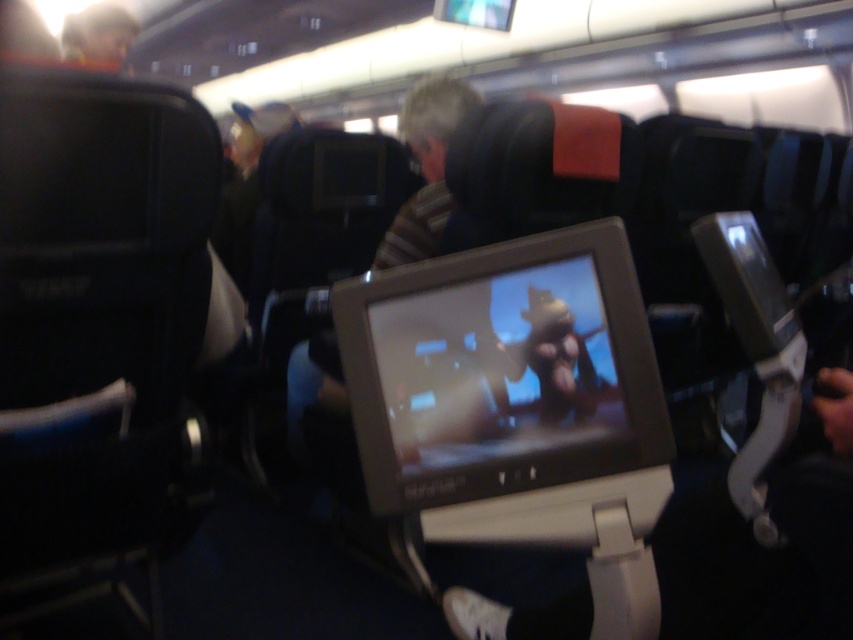
Question: Does matte plastic screen at center appear over smooth plastic toy at upper left?

Choices:
 (A) yes
 (B) no

Answer: (B)

Question: Can you confirm if matte plastic screen at center is bigger than smooth plastic toy at upper left?

Choices:
 (A) yes
 (B) no

Answer: (B)

Question: Considering the relative positions of matte plastic screen at center and smooth plastic toy at upper left in the image provided, where is matte plastic screen at center located with respect to smooth plastic toy at upper left?

Choices:
 (A) above
 (B) below

Answer: (B)

Question: Which object appears closest to the camera in this image?

Choices:
 (A) smooth plastic toy at upper left
 (B) matte plastic screen at center

Answer: (B)

Question: Which point is farther to the camera?

Choices:
 (A) matte plastic screen at center
 (B) smooth plastic toy at upper left

Answer: (B)